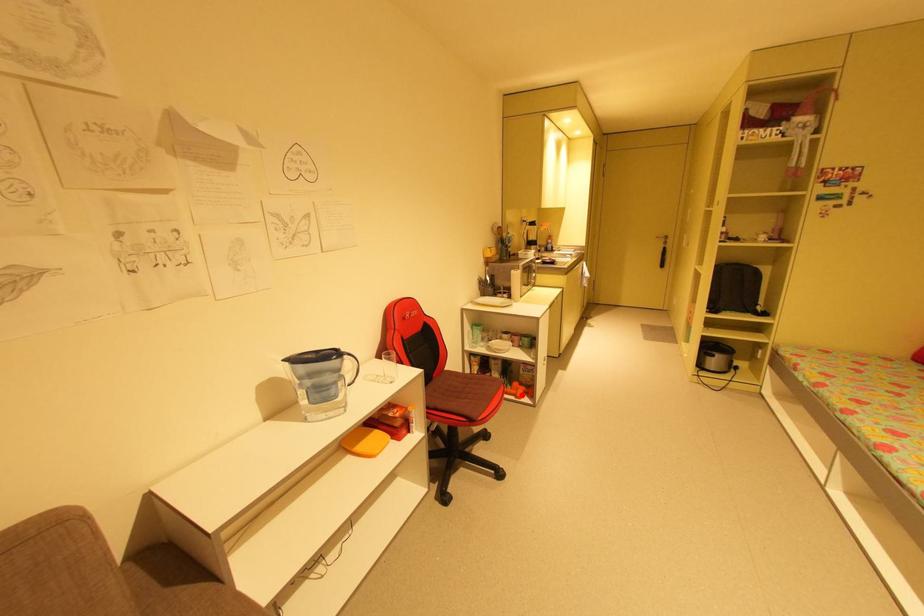
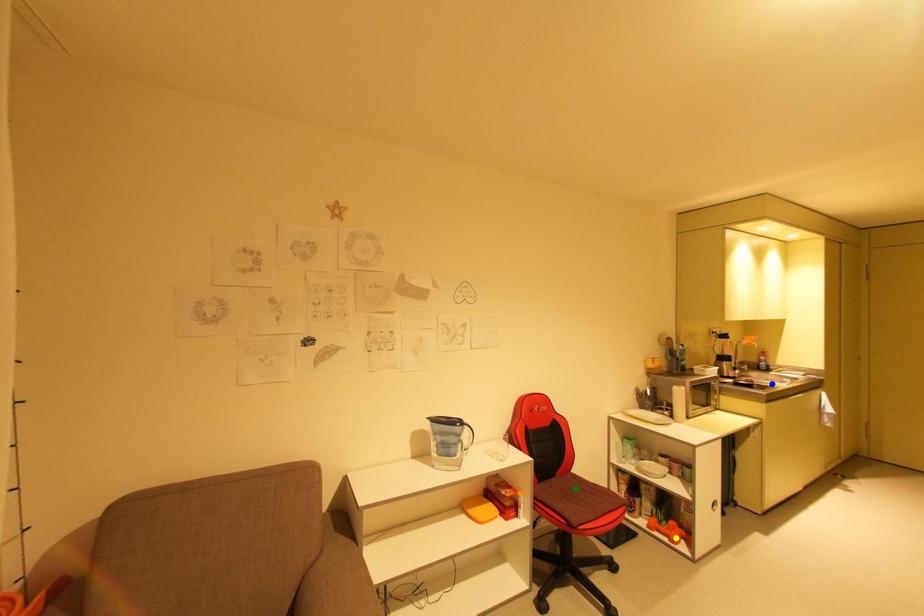
Question: I am providing you with two images of the same scene from different viewpoints. A red point is marked on the first image. You are given multiple points on the second image. Which mark in image 2 goes with the point in image 1?

Choices:
 (A) yellow point
 (B) green point
 (C) blue point

Answer: (A)